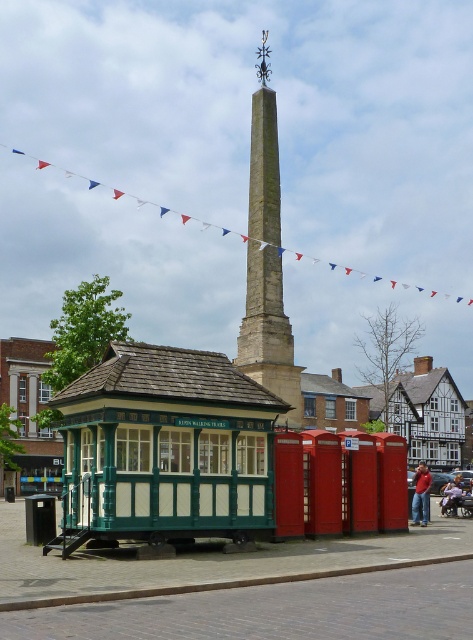
Does green wooden booth at lower left have a greater width compared to red shirt at center?

Yes, green wooden booth at lower left is wider than red shirt at center.

From the picture: Measure the distance between point (57, 451) and camera.

The distance of point (57, 451) from camera is 76.04 meters.

Identify the location of green wooden booth at lower left. (28, 413).

Consider the image. Can you confirm if green wooden booth at lower left is shorter than smooth stone obelisk at center?

Indeed, green wooden booth at lower left has a lesser height compared to smooth stone obelisk at center.

Does point (26, 369) lie in front of point (257, 228)?

No, it is behind (257, 228).

Who is more distant from viewer, (395, 413) or (257, 292)?

The point (395, 413) is more distant.

The image size is (473, 640). I want to click on green wooden booth at lower left, so click(28, 413).

In the scene shown: Does green wood gazebo at center appear on the left side of red shirt at center?

Indeed, green wood gazebo at center is positioned on the left side of red shirt at center.

Can you confirm if green wood gazebo at center is wider than red shirt at center?

In fact, green wood gazebo at center might be narrower than red shirt at center.

What do you see at coordinates (165, 449) in the screenshot?
I see `green wood gazebo at center` at bounding box center [165, 449].

Where is `green wood gazebo at center`? This screenshot has width=473, height=640. green wood gazebo at center is located at coordinates (165, 449).